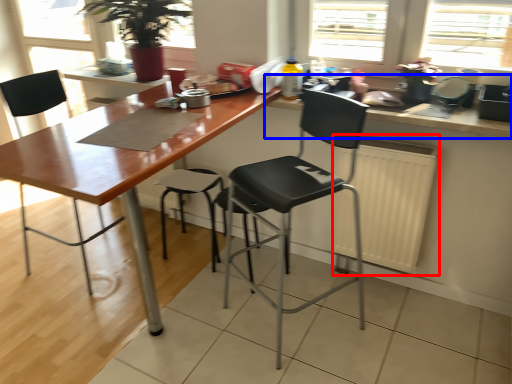
Question: Which object is further to the camera taking this photo, radiator (highlighted by a red box) or countertop (highlighted by a blue box)?

Choices:
 (A) radiator
 (B) countertop

Answer: (A)